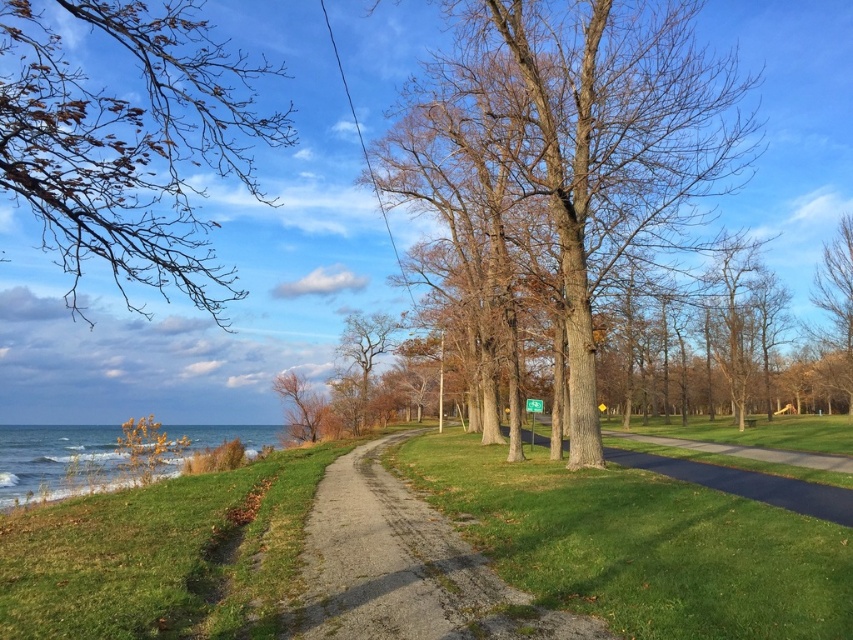
You are a hiker who wants to take a photo of the brown textured tree at upper right. You are currently standing on the green grass at center. To get a clear view of the tree, should you move to your left or right?

Since the green grass at center is to the left of the brown textured tree at upper right, you should move to your right to get a clear view of the brown textured tree at upper right.

You are planning to install a small garden between the green grass at center and the brown textured tree at upper right. If the garden requires a minimum of 100 feet of space between the two points, will there be enough space?

The distance between the green grass at center and the brown textured tree at upper right is 100.75 feet, which exceeds the minimum requirement of 100 feet. Therefore, there is sufficient space to install the garden.

Based on the photo, you are a hiker planning to walk along the dark gray asphalt path at center. You notice the brown textured tree at upper right. Which direction should you walk to stay under the tree for shade?

The dark gray asphalt path at center is below the brown textured tree at upper right, so walking towards the upper right direction along the path will keep you under the tree for shade.